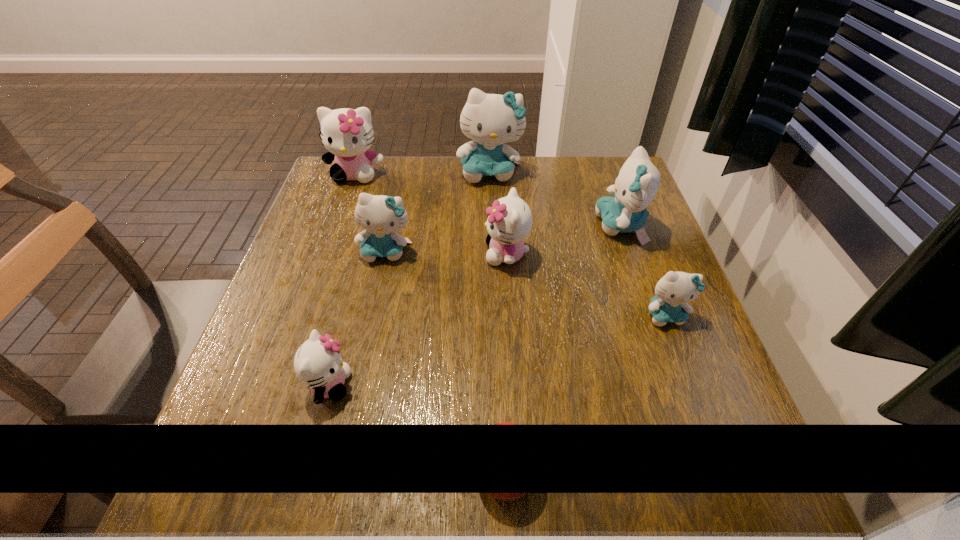
Where is `the tallest kitten`? the tallest kitten is located at coordinates (491, 120).

In order to click on the biggest blue kitten in this screenshot , I will do `click(491, 120)`.

You are a GUI agent. You are given a task and a screenshot of the screen. Output one action in this format:
    pyautogui.click(x=<x>, y=<y>)
    Task: Click on the third smallest blue kitten
    This screenshot has height=540, width=960.
    Given the screenshot: What is the action you would take?
    pyautogui.click(x=638, y=181)

Find the location of a particular element. the biggest white kitten is located at coordinates (347, 134).

The height and width of the screenshot is (540, 960). What are the coordinates of `the second smallest white kitten` in the screenshot? It's located at [510, 219].

At what (x,y) coordinates should I click in order to perform the action: click on the second farthest white kitten. Please return your answer as a coordinate pair (x, y). The image size is (960, 540). Looking at the image, I should click on (510, 219).

Where is `the leftmost blue kitten`? The image size is (960, 540). the leftmost blue kitten is located at coordinates (381, 216).

I want to click on the seventh farthest object, so tap(318, 363).

Identify the location of the nearest white kitten. This screenshot has height=540, width=960. (318, 363).

You are a GUI agent. You are given a task and a screenshot of the screen. Output one action in this format:
    pyautogui.click(x=<x>, y=<y>)
    Task: Click on the third nearest object
    
    Given the screenshot: What is the action you would take?
    pyautogui.click(x=674, y=290)